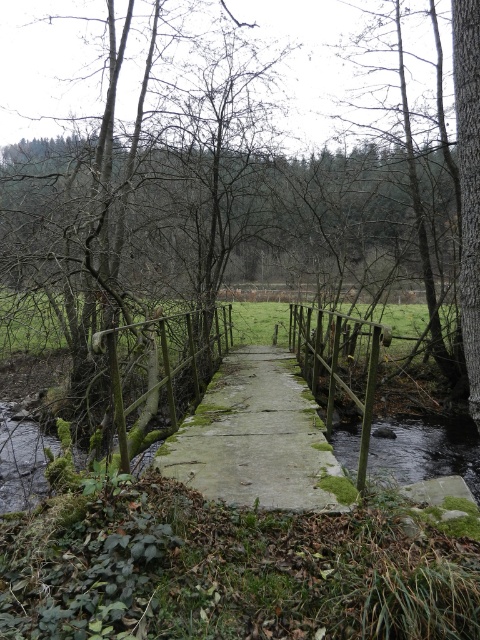
In the scene shown: You are a hiker standing on the mossy concrete bridge at center. You look up and see the green mossy tree at center. Is the tree above or below the bridge?

The green mossy tree at center is above the mossy concrete bridge at center, so the tree is above the bridge.